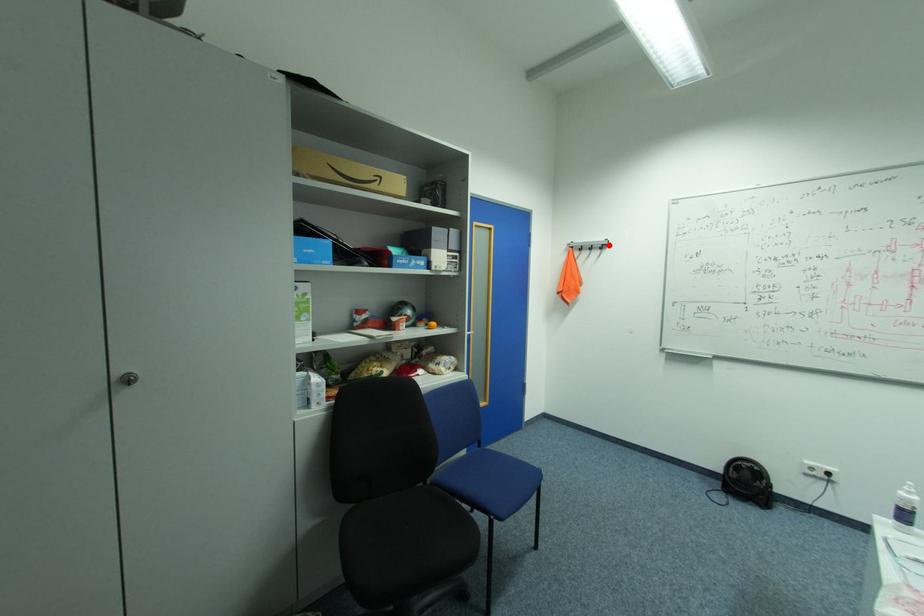
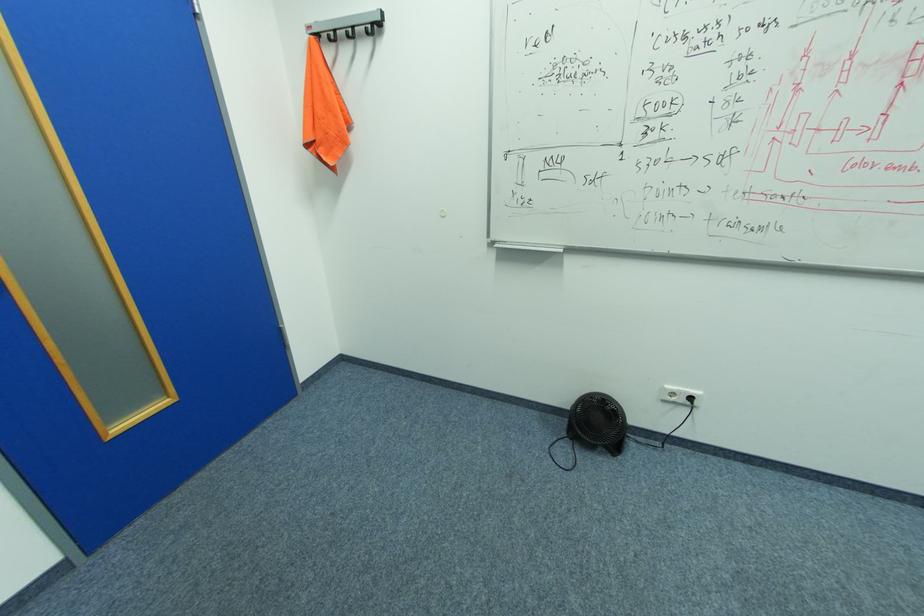
The point at the highlighted location is marked in the first image. Where is the corresponding point in the second image?

(379, 23)